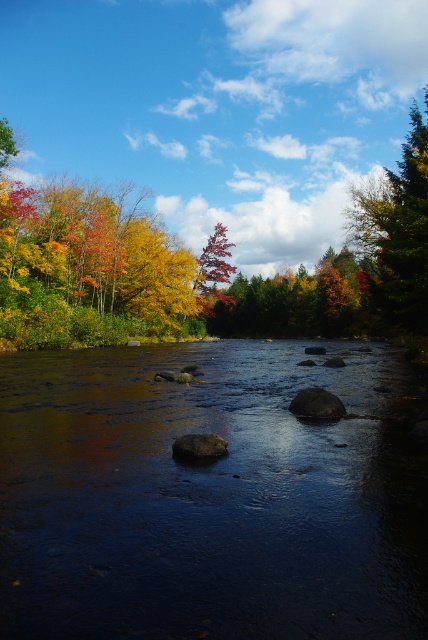
You are an explorer trying to cross the river in the scene. You see the dark reflective water at center and the shiny red tree at center. Which object should you avoid stepping on to stay safe?

You should avoid stepping on the dark reflective water at center because it is positioned on the right side of the shiny red tree at center, indicating it is the river surface where you might slip or fall.

You are an artist painting the scene and want to place autumn foliage at center and green matte tree at upper right in your painting. Which object should you paint first if you follow the rule of painting left objects before right ones?

You should paint the autumn foliage at center first because it is positioned on the left side of green matte tree at upper right, so according to the rule, left objects are painted before right ones.